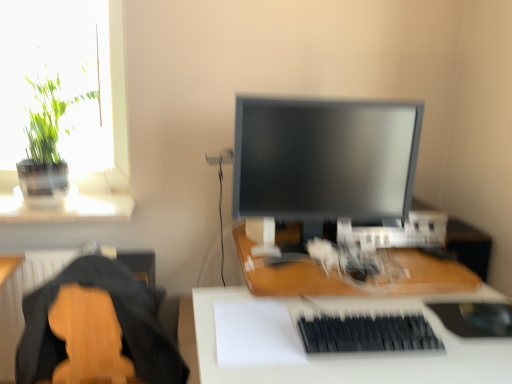
What is the approximate width of wooden guitar at lower left?

It is 19.39 inches.

Describe the element at coordinates (22, 297) in the screenshot. I see `wooden guitar at lower left` at that location.

This screenshot has width=512, height=384. What do you see at coordinates (324, 164) in the screenshot?
I see `matte black monitor at center` at bounding box center [324, 164].

What is the approximate height of matte black monitor at center?

matte black monitor at center is 22.67 inches tall.

Where is `black rubber mousepad at lower right`? black rubber mousepad at lower right is located at coordinates (476, 318).

Describe the element at coordinates (476, 318) in the screenshot. I see `black rubber mousepad at lower right` at that location.

Image resolution: width=512 pixels, height=384 pixels. In order to click on wooden guitar at lower left in this screenshot , I will do `click(22, 297)`.

Is wooden desk at center, arranged as the 1th desk when viewed from the top, taller than white matte desk at center, which is counted as the first desk, starting from the bottom?

No, wooden desk at center, arranged as the 1th desk when viewed from the top, is not taller than white matte desk at center, which is counted as the first desk, starting from the bottom.

Is wooden desk at center, arranged as the 1th desk when viewed from the top, at the left side of white matte desk at center, which is counted as the first desk, starting from the bottom?

Yes.

In the scene shown: Is wooden desk at center, arranged as the 1th desk when viewed from the top, positioned before white matte desk at center, positioned as the second desk in top-to-bottom order?

No, the depth of wooden desk at center, arranged as the 1th desk when viewed from the top, is greater than that of white matte desk at center, positioned as the second desk in top-to-bottom order.

Considering the relative sizes of wooden desk at center, which appears as the second desk when ordered from the bottom, and white matte desk at center, which is counted as the first desk, starting from the bottom, in the image provided, is wooden desk at center, which appears as the second desk when ordered from the bottom, wider than white matte desk at center, which is counted as the first desk, starting from the bottom,?

No.

What's the angular difference between green leafy plant at upper left and white matte desk at center, positioned as the second desk in top-to-bottom order,'s facing directions?

The angle between the facing direction of green leafy plant at upper left and the facing direction of white matte desk at center, positioned as the second desk in top-to-bottom order, is 1.03 degrees.

Measure the distance from green leafy plant at upper left to white matte desk at center, positioned as the second desk in top-to-bottom order.

A distance of 3.50 feet exists between green leafy plant at upper left and white matte desk at center, positioned as the second desk in top-to-bottom order.

From a real-world perspective, is green leafy plant at upper left above or below white matte desk at center, which is counted as the first desk, starting from the bottom?

From a real-world perspective, green leafy plant at upper left is physically above white matte desk at center, which is counted as the first desk, starting from the bottom.

From the image's perspective, which one is positioned higher, green leafy plant at upper left or white matte desk at center, positioned as the second desk in top-to-bottom order?

From the image's view, green leafy plant at upper left is above.

Does white matte desk at center, positioned as the second desk in top-to-bottom order, appear on the left side of wooden guitar at lower left?

No.

Does point (219, 299) appear closer or farther from the camera than point (13, 302)?

Point (219, 299).

Does white matte desk at center, positioned as the second desk in top-to-bottom order, have a lesser width compared to wooden guitar at lower left?

In fact, white matte desk at center, positioned as the second desk in top-to-bottom order, might be wider than wooden guitar at lower left.

This screenshot has width=512, height=384. I want to click on desk that is in front of the wooden guitar at lower left, so click(x=350, y=353).

Looking at this image, does white matte desk at center, which is counted as the first desk, starting from the bottom, appear on the left side of matte black monitor at center?

No.

Can you confirm if white matte desk at center, which is counted as the first desk, starting from the bottom, is wider than matte black monitor at center?

Indeed, white matte desk at center, which is counted as the first desk, starting from the bottom, has a greater width compared to matte black monitor at center.

Is white matte desk at center, positioned as the second desk in top-to-bottom order, behind matte black monitor at center?

No, it is in front of matte black monitor at center.

Between white matte desk at center, which is counted as the first desk, starting from the bottom, and matte black monitor at center, which one has smaller size?

matte black monitor at center.

Considering the sizes of objects wooden desk at center, which appears as the second desk when ordered from the bottom, and matte black monitor at center in the image provided, who is bigger, wooden desk at center, which appears as the second desk when ordered from the bottom, or matte black monitor at center?

With larger size is matte black monitor at center.

Is wooden desk at center, arranged as the 1th desk when viewed from the top, oriented towards matte black monitor at center?

No, wooden desk at center, arranged as the 1th desk when viewed from the top, is not oriented towards matte black monitor at center.

Does wooden desk at center, arranged as the 1th desk when viewed from the top, have a greater width compared to matte black monitor at center?

Correct, the width of wooden desk at center, arranged as the 1th desk when viewed from the top, exceeds that of matte black monitor at center.

Which is correct: black rubber mousepad at lower right is inside matte black monitor at center, or outside of it?

black rubber mousepad at lower right lies outside matte black monitor at center.

From a real-world perspective, which is physically below, black rubber mousepad at lower right or matte black monitor at center?

black rubber mousepad at lower right is physically lower.

Does black rubber mousepad at lower right have a smaller size compared to matte black monitor at center?

Correct, black rubber mousepad at lower right occupies less space than matte black monitor at center.

Does black rubber mousepad at lower right come behind matte black monitor at center?

No, the depth of black rubber mousepad at lower right is less than that of matte black monitor at center.

Consider the image. Is black matte keyboard at lower center not close to green leafy plant at upper left?

That's right, there is a large distance between black matte keyboard at lower center and green leafy plant at upper left.

Which of these two, black matte keyboard at lower center or green leafy plant at upper left, is wider?

green leafy plant at upper left.

Would you say black matte keyboard at lower center is to the left or to the right of green leafy plant at upper left in the picture?

From the image, it's evident that black matte keyboard at lower center is to the right of green leafy plant at upper left.

The height and width of the screenshot is (384, 512). I want to click on desk below the wooden desk at center, which appears as the second desk when ordered from the bottom (from a real-world perspective), so click(350, 353).

Locate an element on the screen. This screenshot has height=384, width=512. window screen behind the white matte desk at center, positioned as the second desk in top-to-bottom order is located at coordinates (56, 77).

Considering their positions, is black matte keyboard at lower center positioned further to wooden guitar at lower left than black rubber mousepad at lower right?

The object further to wooden guitar at lower left is black rubber mousepad at lower right.

When comparing their distances from white matte desk at center, which is counted as the first desk, starting from the bottom, does wooden desk at center, arranged as the 1th desk when viewed from the top, or green leafy plant at upper left seem further?

The object further to white matte desk at center, which is counted as the first desk, starting from the bottom, is green leafy plant at upper left.

When comparing their distances from matte black monitor at center, does black matte keyboard at lower center or green leafy plant at upper left seem closer?

black matte keyboard at lower center.

Estimate the real-world distances between objects in this image. Which object is further from wooden guitar at lower left, matte black monitor at center or wooden desk at center, arranged as the 1th desk when viewed from the top?

matte black monitor at center lies further to wooden guitar at lower left than the other object.

Looking at the image, which one is located closer to wooden desk at center, arranged as the 1th desk when viewed from the top, green leafy plant at upper left or matte black monitor at center?

Among the two, matte black monitor at center is located nearer to wooden desk at center, arranged as the 1th desk when viewed from the top.

Considering their positions, is green leafy plant at upper left positioned further to black matte keyboard at lower center than black rubber mousepad at lower right?

The object further to black matte keyboard at lower center is green leafy plant at upper left.

Which object lies nearer to the anchor point green leafy plant at upper left, white matte desk at center, positioned as the second desk in top-to-bottom order, or matte black monitor at center?

matte black monitor at center is positioned closer to the anchor green leafy plant at upper left.

Which object lies further to the anchor point matte black monitor at center, wooden desk at center, which appears as the second desk when ordered from the bottom, or black rubber mousepad at lower right?

black rubber mousepad at lower right lies further to matte black monitor at center than the other object.

This screenshot has width=512, height=384. I want to click on computer monitor situated between wooden guitar at lower left and wooden desk at center, which appears as the second desk when ordered from the bottom, from left to right, so click(324, 164).

The image size is (512, 384). Find the location of `desk between wooden guitar at lower left and white matte desk at center, which is counted as the first desk, starting from the bottom`. desk between wooden guitar at lower left and white matte desk at center, which is counted as the first desk, starting from the bottom is located at coordinates (285, 274).

Locate an element on the screen. The width and height of the screenshot is (512, 384). computer monitor located between green leafy plant at upper left and wooden desk at center, arranged as the 1th desk when viewed from the top, in the left-right direction is located at coordinates [324, 164].

This screenshot has width=512, height=384. I want to click on computer keyboard situated between wooden desk at center, arranged as the 1th desk when viewed from the top, and black rubber mousepad at lower right from left to right, so click(367, 333).